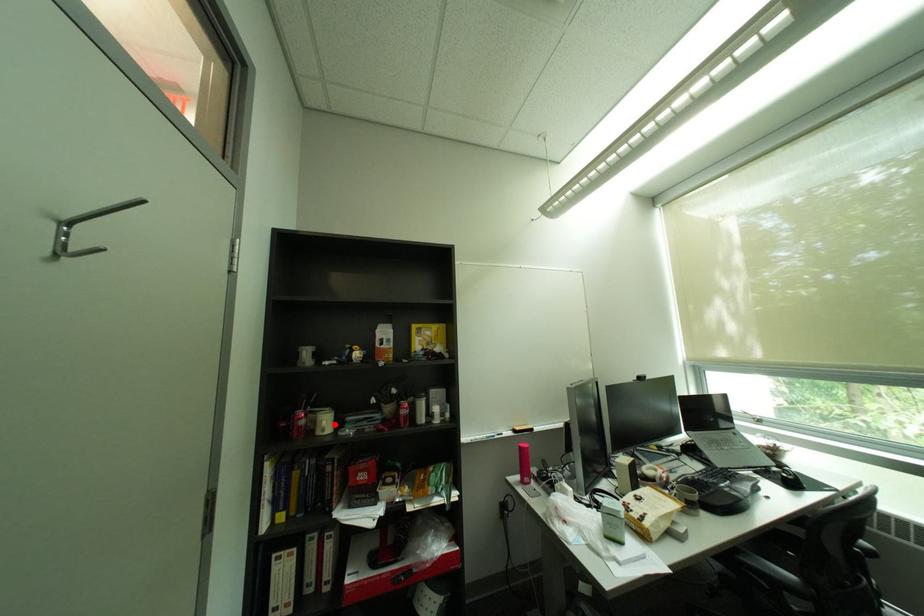
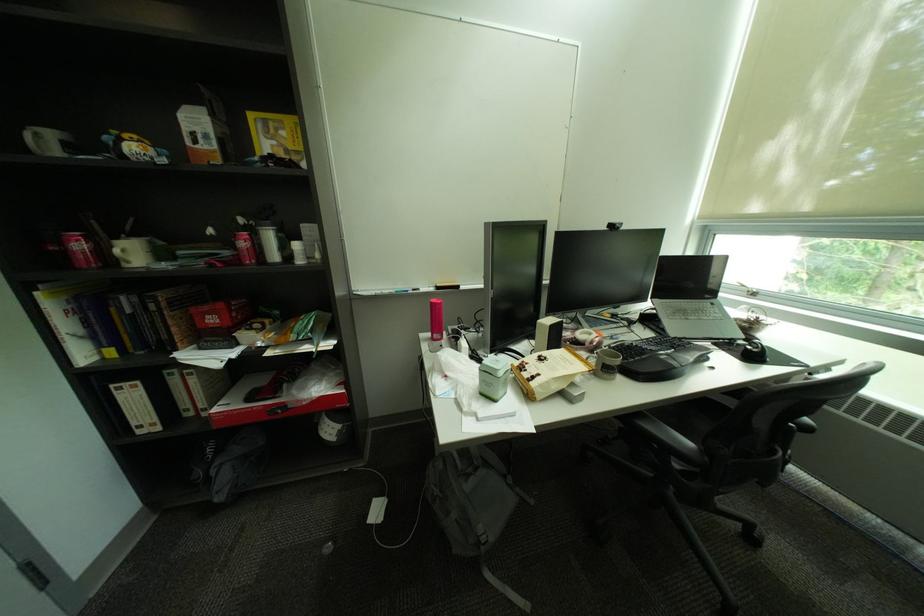
In the second image, find the point that corresponds to the highlighted location in the first image.

(128, 252)